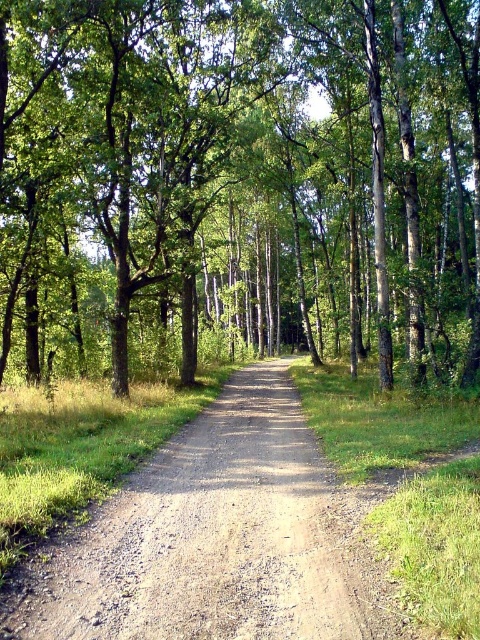
Who is shorter, green leafy tree at center or brown gravel road at center?

With less height is brown gravel road at center.

What do you see at coordinates (241, 179) in the screenshot? This screenshot has width=480, height=640. I see `green leafy tree at center` at bounding box center [241, 179].

Is point (79, 172) farther from camera compared to point (286, 579)?

Yes, point (79, 172) is behind point (286, 579).

Locate an element on the screen. green leafy tree at center is located at coordinates coord(241,179).